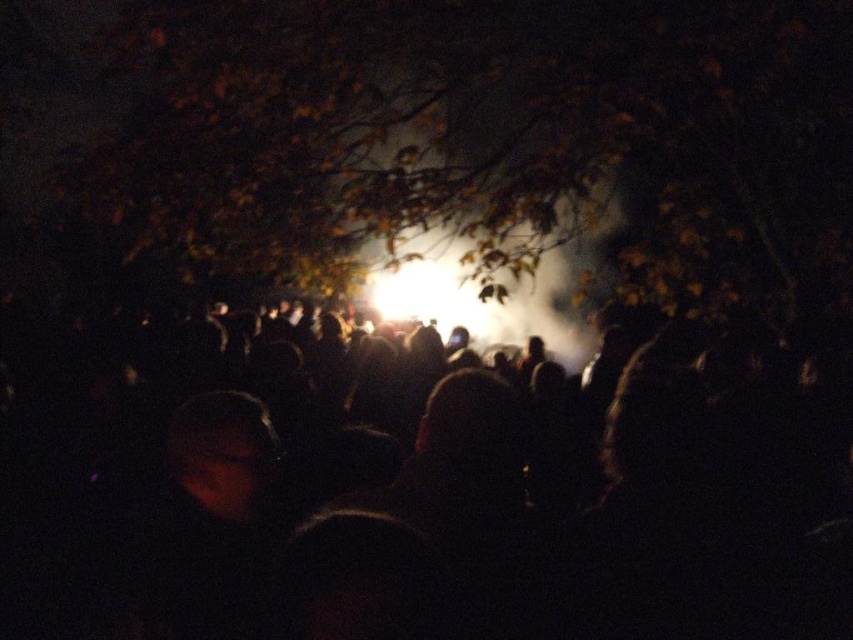
How far apart are black matte crowd at center and brown leafy tree at upper center?

black matte crowd at center is 31.75 feet from brown leafy tree at upper center.

Is black matte crowd at center above brown leafy tree at upper center?

No.

Who is more forward, [276,509] or [786,33]?

Point [276,509] is in front.

What are the coordinates of `black matte crowd at center` in the screenshot? It's located at click(419, 490).